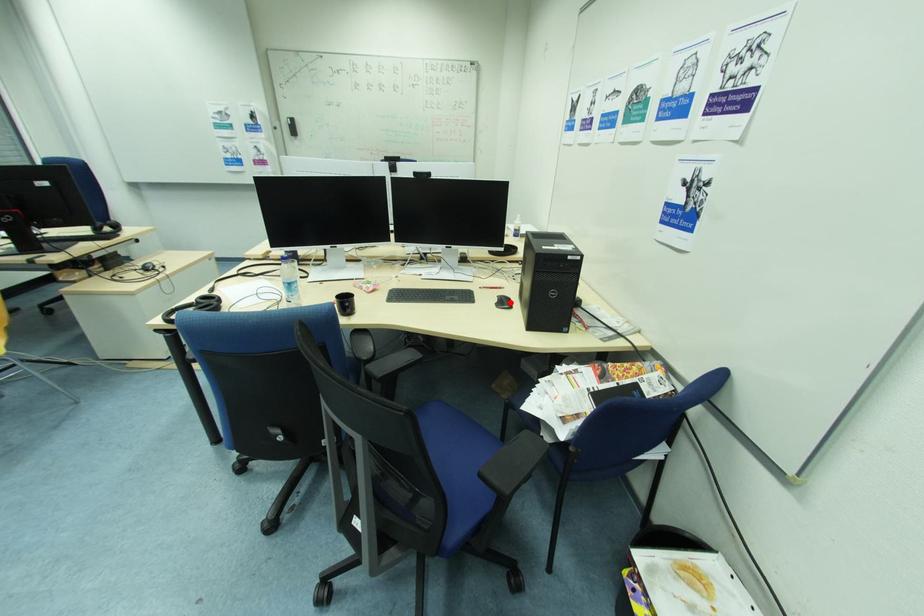
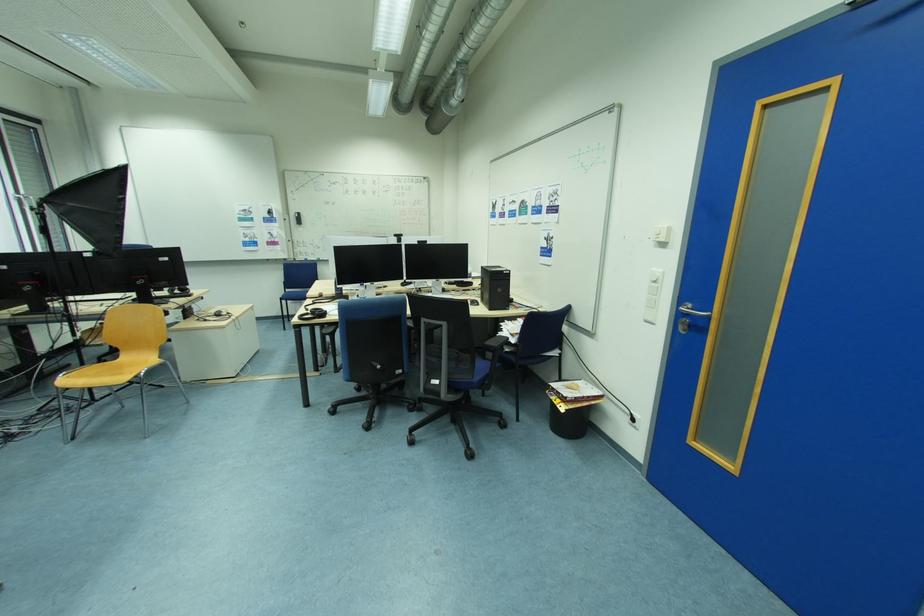
The point at the highlighted location is marked in the first image. Where is the corresponding point in the second image?

(480, 304)